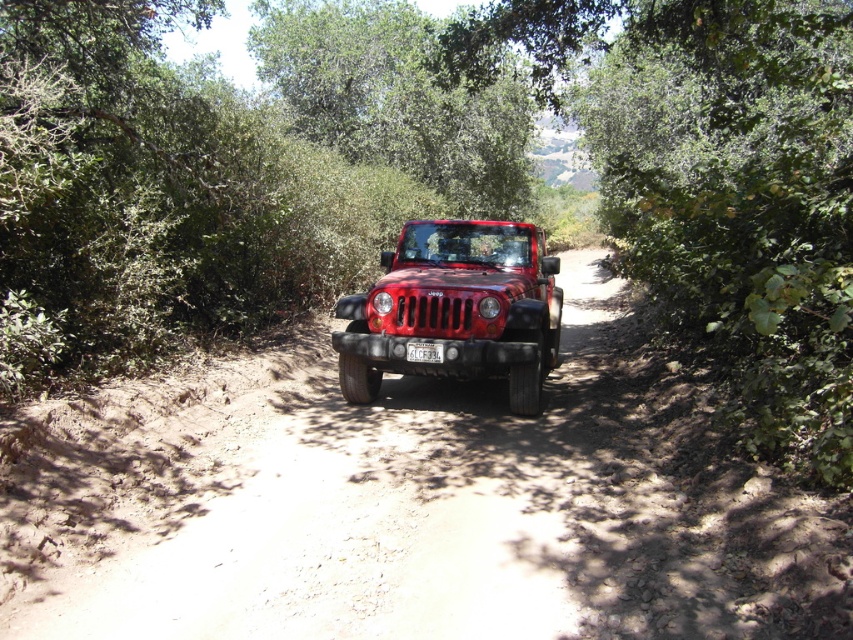
You are a hiker planning to walk past the green leafy tree at center and the matte red jeep at center. Which object will you encounter first based on their positions?

The matte red jeep at center is positioned centrally in the frame and heading towards the viewer, so you will encounter the matte red jeep at center first before reaching the green leafy tree at center.

Looking at this image, you are a hiker trying to take a photo of the matte red jeep at center from the green leafy tree at center. Which side of the tree should you position yourself to get the best view of the jeep?

The green leafy tree at center is to the right of the matte red jeep at center, so you should position yourself to the left side of the tree to get the best view of the matte red jeep at center.